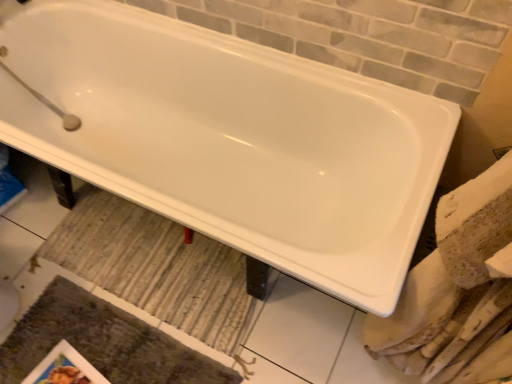
At what (x,y) coordinates should I click in order to perform the action: click on vacant location behind textured gray bath mat at lower left, placed as the 2th bath mat when sorted from top to bottom. Please return your answer as a coordinate pair (x, y). This screenshot has width=512, height=384. Looking at the image, I should click on (122, 256).